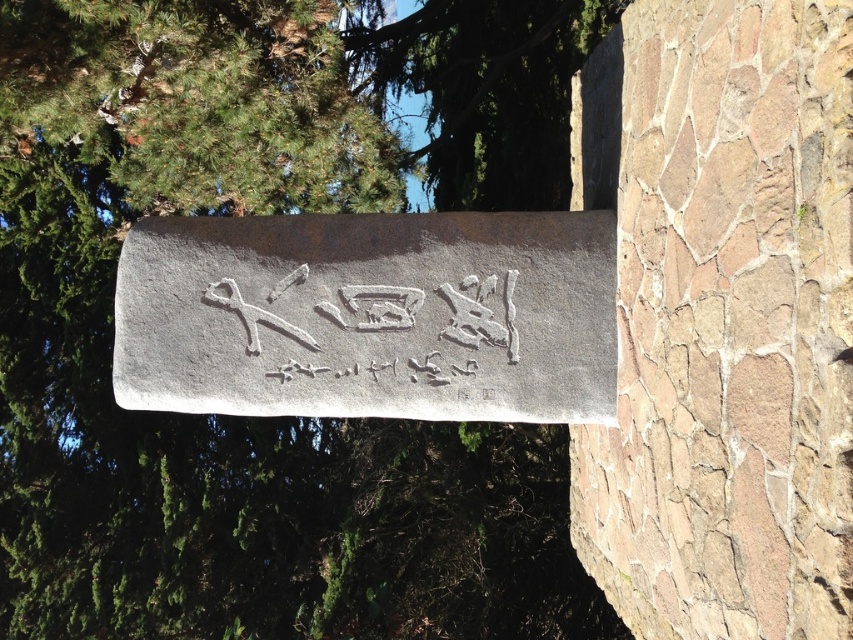
Question: Can you confirm if white stone sign at center is smaller than green leafy tree at upper center?

Choices:
 (A) yes
 (B) no

Answer: (A)

Question: Does white stone sign at center appear over white carved stone at center?

Choices:
 (A) yes
 (B) no

Answer: (A)

Question: Which point appears farthest from the camera in this image?

Choices:
 (A) 221,296
 (B) 537,268
 (C) 456,100
 (D) 500,161

Answer: (C)

Question: Which object is the closest to the white carved stone at center?

Choices:
 (A) white stone sign at center
 (B) green leafy tree at upper left

Answer: (A)

Question: Which of the following is the closest to the observer?

Choices:
 (A) (463, 202)
 (B) (569, 419)
 (C) (271, 316)
 (D) (474, 621)

Answer: (C)

Question: Can you confirm if green leafy tree at upper left is wider than white stone sign at center?

Choices:
 (A) yes
 (B) no

Answer: (B)